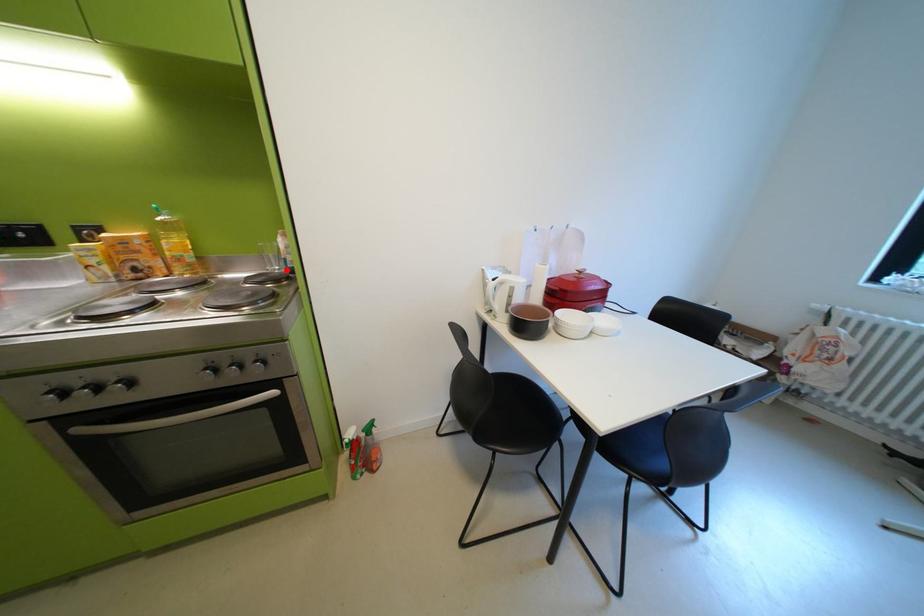
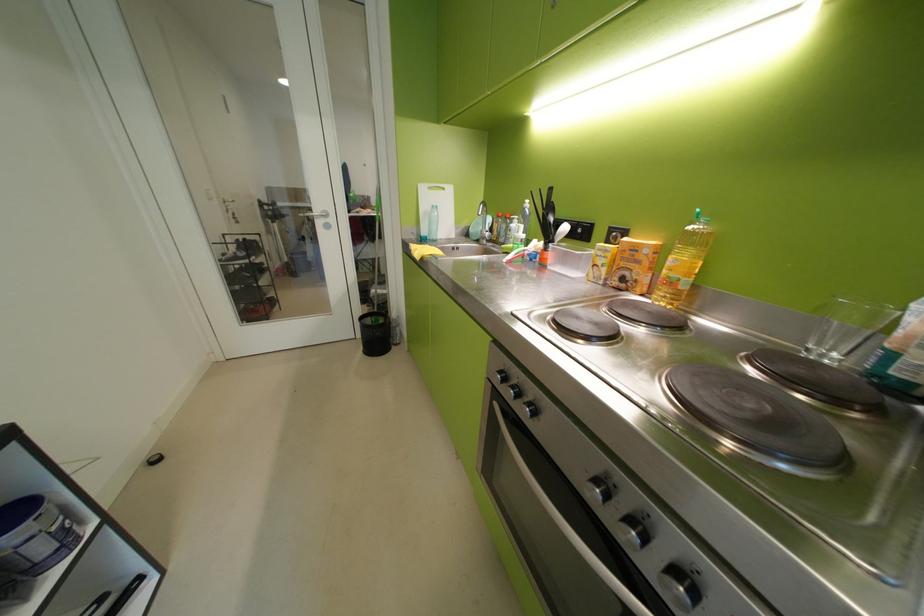
In the second image, find the point that corresponds to the highlighted location in the first image.

(843, 358)